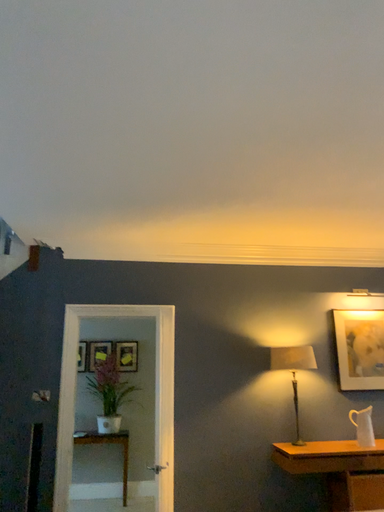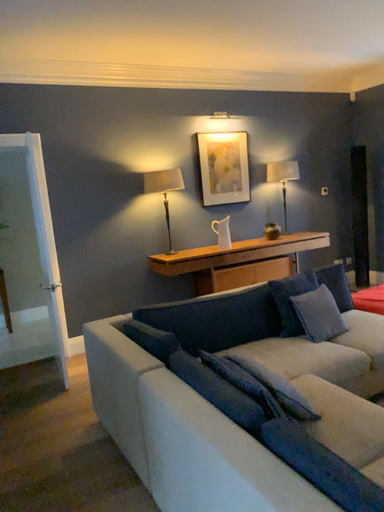
Question: Which way did the camera rotate in the video?

Choices:
 (A) rotated upward
 (B) rotated downward

Answer: (B)